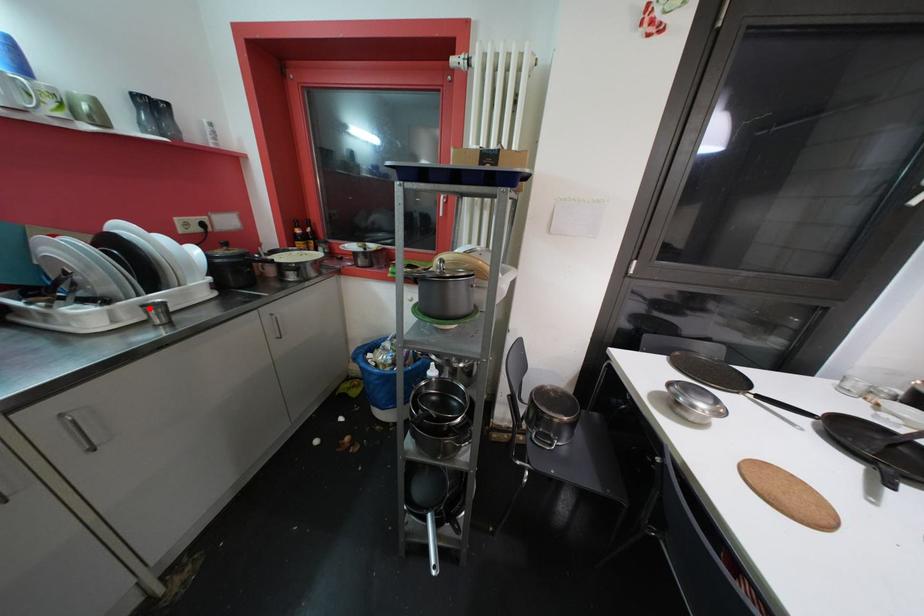
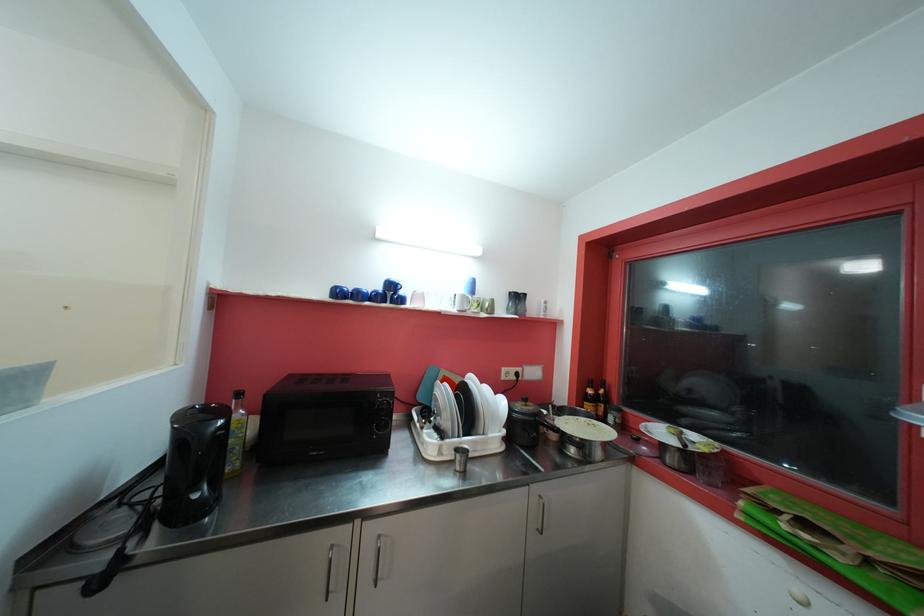
The point at the highlighted location is marked in the first image. Where is the corresponding point in the second image?

(462, 452)